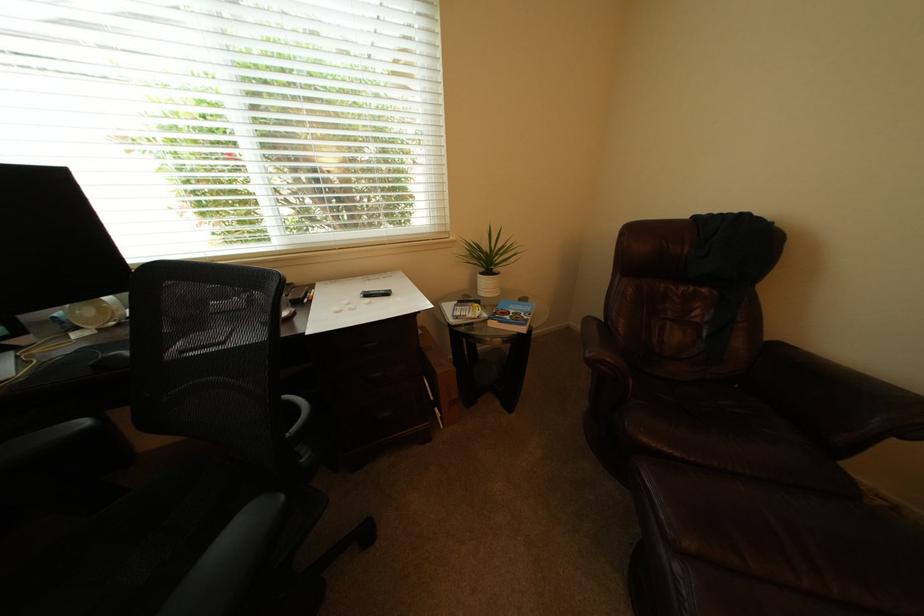
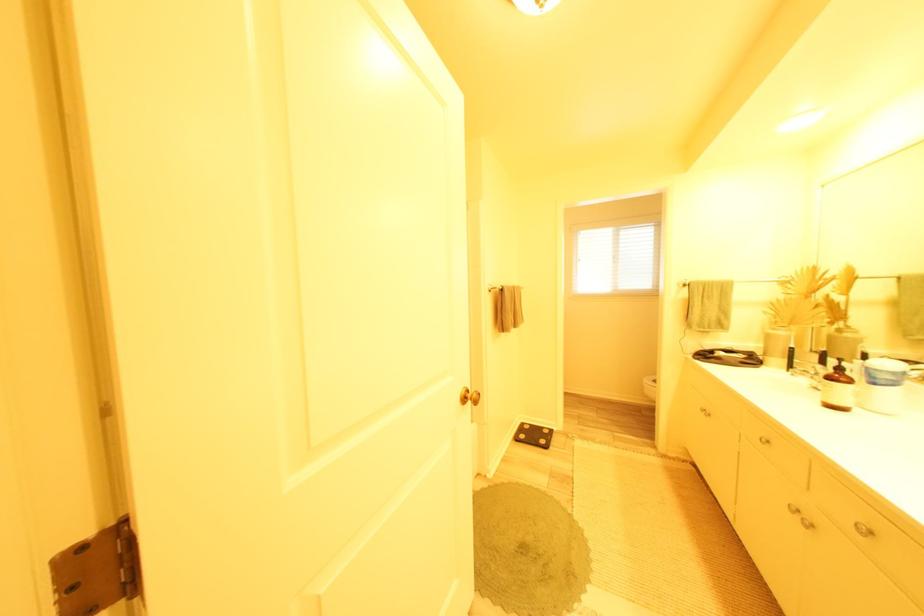
Question: I am providing you with two images of the same scene from different viewpoints. After the viewpoint changes to image2, which objects are now occluded?

Choices:
 (A) dark sofa seat
 (B) brown leather armrest
 (C) faucet handle
 (D) cabinet knob

Answer: (B)